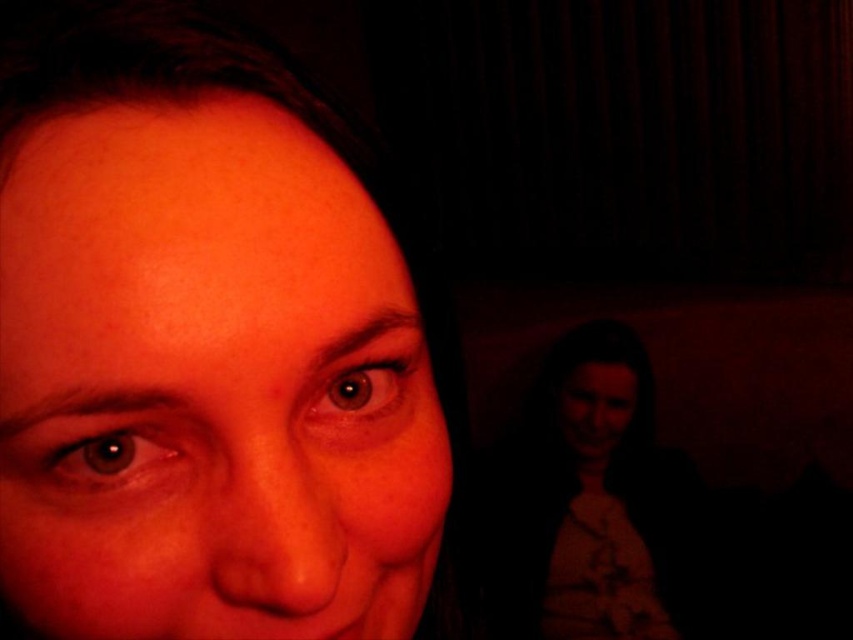
You are a photographer adjusting the lighting in a dimly lit room. You notice the matte skin at center and the matte white blouse at lower right. Which object should you focus on to ensure proper exposure for the subject?

You should focus on the matte skin at center because it is in front of the matte white blouse at lower right, making it the primary subject closer to the camera.

You are standing in the dimly lit area and want to move closer to the two points in the image. Based on their positions, which point should you move toward first if you want to reach the one that is nearer to you first? The points are point (328, 198) and point (598, 403).

You should move toward point (328, 198) first because it is closer to you than point (598, 403).

You are a photographer adjusting lighting for a portrait. You have to ensure that the matte skin at center and the matte white blouse at lower right are both visible in the final image. Given their sizes, which object might require more careful lighting adjustments to avoid being too bright or too dark?

The matte skin at center occupies less space than the matte white blouse at lower right, so the smaller matte skin at center might require more careful lighting adjustments to ensure it doesn not get lost in the shadows or overexposed compared to the larger matte white blouse at lower right.